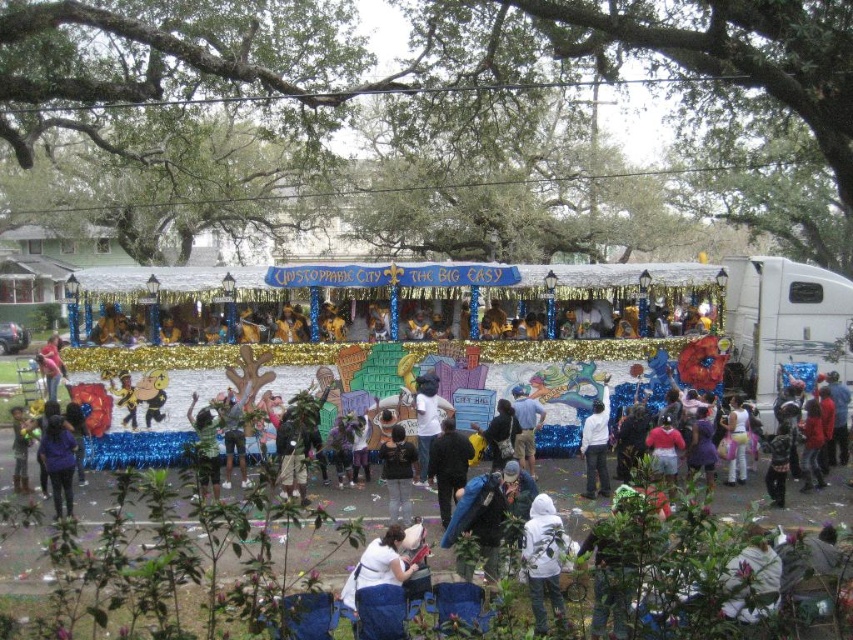
Question: Which point is closer to the camera?

Choices:
 (A) (x=392, y=577)
 (B) (x=387, y=497)
 (C) (x=535, y=512)
 (D) (x=51, y=396)

Answer: (A)

Question: In this image, where is black fabric shirt at center located relative to white cotton dress at center?

Choices:
 (A) below
 (B) above

Answer: (A)

Question: Which is nearer to the black fabric shirt at center?

Choices:
 (A) blue denim jeans at center
 (B) black matte jacket at center
 (C) matte purple jacket at lower left
 (D) white fabric at center

Answer: (B)

Question: Is the position of matte purple jacket at lower left more distant than that of white cotton dress at center?

Choices:
 (A) no
 (B) yes

Answer: (A)

Question: Which object is positioned farthest from the white fleece hoodie at lower center?

Choices:
 (A) matte pink shirt at center
 (B) blue denim jeans at center

Answer: (A)

Question: In this image, where is white fleece hoodie at lower center located relative to black matte jacket at center?

Choices:
 (A) below
 (B) above

Answer: (A)